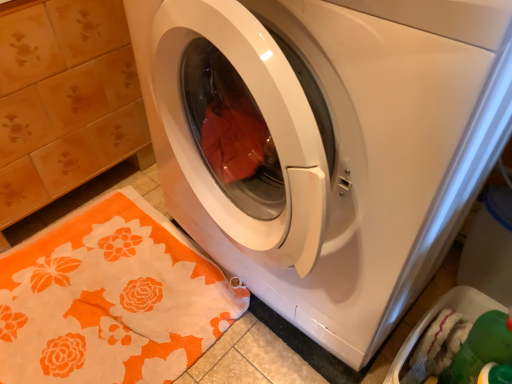
Where is `white glossy washing machine at center`? This screenshot has height=384, width=512. white glossy washing machine at center is located at coordinates (331, 145).

Which is behind, point (207, 282) or point (404, 343)?

The point (207, 282) is more distant.

Is orange floral rug at lower left surrounding green plastic dish washer at lower right?

No, green plastic dish washer at lower right is not surrounded by orange floral rug at lower left.

Which of these two, orange floral rug at lower left or green plastic dish washer at lower right, stands taller?

With more height is green plastic dish washer at lower right.

From a real-world perspective, which object stands above the other?

From a 3D spatial view, green plastic dish washer at lower right is above.

Is white glossy washing machine at center far away from green plastic dish washer at lower right?

Actually, white glossy washing machine at center and green plastic dish washer at lower right are a little close together.

Which object is further away from the camera, white glossy washing machine at center or green plastic dish washer at lower right?

green plastic dish washer at lower right is further away from the camera.

Who is bigger, white glossy washing machine at center or green plastic dish washer at lower right?

Bigger between the two is white glossy washing machine at center.

Considering the relative sizes of white glossy washing machine at center and green plastic dish washer at lower right in the image provided, is white glossy washing machine at center shorter than green plastic dish washer at lower right?

No, white glossy washing machine at center is not shorter than green plastic dish washer at lower right.

From the image's perspective, relative to orange floral rug at lower left, is green plastic dish washer at lower right above or below?

Clearly, from the image's perspective, green plastic dish washer at lower right is above orange floral rug at lower left.

Who is taller, green plastic dish washer at lower right or orange floral rug at lower left?

green plastic dish washer at lower right.

Between green plastic dish washer at lower right and orange floral rug at lower left, which one has smaller size?

With smaller size is green plastic dish washer at lower right.

Based on the photo, how different are the orientations of green plastic dish washer at lower right and orange floral rug at lower left in degrees?

There is a 88.3-degree angle between the facing directions of green plastic dish washer at lower right and orange floral rug at lower left.

Is white glossy washing machine at center a part of orange floral rug at lower left?

Actually, white glossy washing machine at center is outside orange floral rug at lower left.

In the scene shown: How distant is orange floral rug at lower left from white glossy washing machine at center?

The distance of orange floral rug at lower left from white glossy washing machine at center is 14.10 inches.

Considering the relative sizes of orange floral rug at lower left and white glossy washing machine at center in the image provided, is orange floral rug at lower left shorter than white glossy washing machine at center?

Yes, orange floral rug at lower left is shorter than white glossy washing machine at center.

What's the angular difference between orange floral rug at lower left and white glossy washing machine at center's facing directions?

There is a 88.6-degree angle between the facing directions of orange floral rug at lower left and white glossy washing machine at center.

Considering the positions of objects green plastic dish washer at lower right and white glossy washing machine at center in the image provided, who is more to the right, green plastic dish washer at lower right or white glossy washing machine at center?

green plastic dish washer at lower right is more to the right.

Considering the relative sizes of green plastic dish washer at lower right and white glossy washing machine at center in the image provided, is green plastic dish washer at lower right shorter than white glossy washing machine at center?

Yes.

From the picture: Would you say green plastic dish washer at lower right is inside or outside white glossy washing machine at center?

The correct answer is: outside.

The image size is (512, 384). I want to click on dish washer below the white glossy washing machine at center (from a real-world perspective), so click(x=436, y=314).

In terms of height, does white glossy washing machine at center look taller or shorter compared to orange floral rug at lower left?

Considering their sizes, white glossy washing machine at center has more height than orange floral rug at lower left.

Looking at this image, can you see white glossy washing machine at center touching orange floral rug at lower left?

No, white glossy washing machine at center is not beside orange floral rug at lower left.

Based on their positions, is white glossy washing machine at center located to the left or right of orange floral rug at lower left?

In the image, white glossy washing machine at center appears on the right side of orange floral rug at lower left.

There is a orange floral rug at lower left. Identify the location of dish washer above it (from a real-world perspective). Image resolution: width=512 pixels, height=384 pixels. (436, 314).

I want to click on washing machine that is on the left side of green plastic dish washer at lower right, so click(x=331, y=145).

Based on their spatial positions, is white glossy washing machine at center or orange floral rug at lower left further from green plastic dish washer at lower right?

orange floral rug at lower left is further to green plastic dish washer at lower right.

Looking at this image, based on their spatial positions, is white glossy washing machine at center or green plastic dish washer at lower right closer to orange floral rug at lower left?

Based on the image, white glossy washing machine at center appears to be nearer to orange floral rug at lower left.

Estimate the real-world distances between objects in this image. Which object is further from orange floral rug at lower left, green plastic dish washer at lower right or white glossy washing machine at center?

Among the two, green plastic dish washer at lower right is located further to orange floral rug at lower left.

Considering their positions, is orange floral rug at lower left positioned further to white glossy washing machine at center than green plastic dish washer at lower right?

Based on the image, green plastic dish washer at lower right appears to be further to white glossy washing machine at center.

When comparing their distances from white glossy washing machine at center, does green plastic dish washer at lower right or orange floral rug at lower left seem further?

Based on the image, green plastic dish washer at lower right appears to be further to white glossy washing machine at center.

From the image, which object appears to be nearer to green plastic dish washer at lower right, orange floral rug at lower left or white glossy washing machine at center?

white glossy washing machine at center.

I want to click on washing machine between orange floral rug at lower left and green plastic dish washer at lower right from left to right, so click(x=331, y=145).